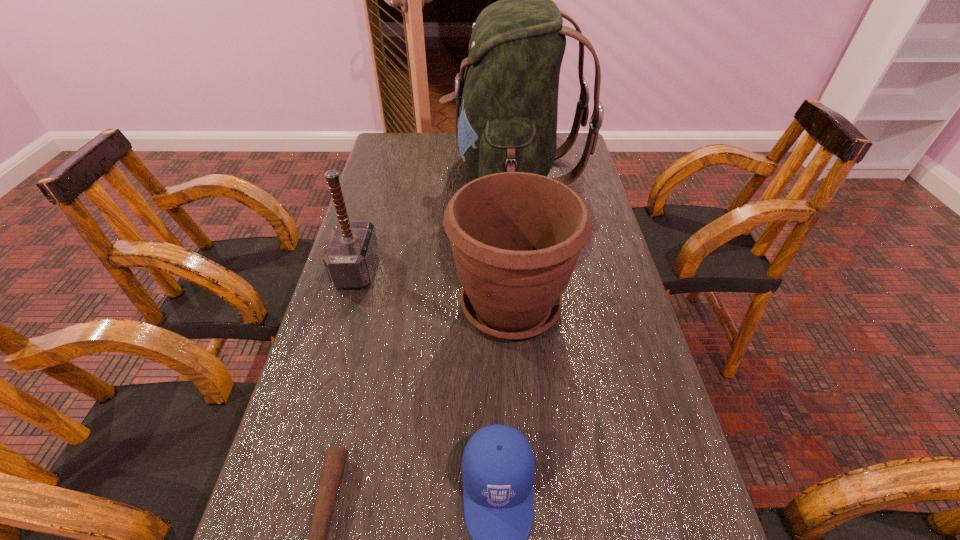
Identify which object is the nearest to the flowerpot. Please provide its 2D coordinates. Your answer should be formatted as a tuple, i.e. [(x, y)], where the tuple contains the x and y coordinates of a point satisfying the conditions above.

[(508, 97)]